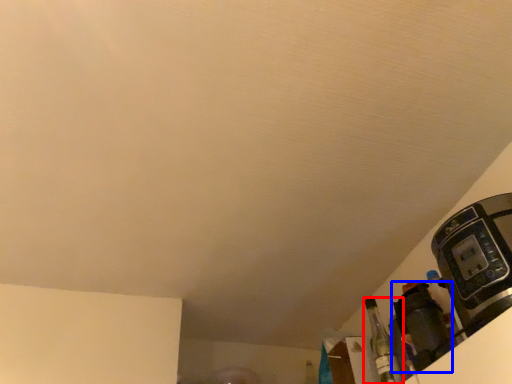
Question: Which of the following is the closest to the observer, bottle (highlighted by a red box) or appliance (highlighted by a blue box)?

Choices:
 (A) bottle
 (B) appliance

Answer: (B)